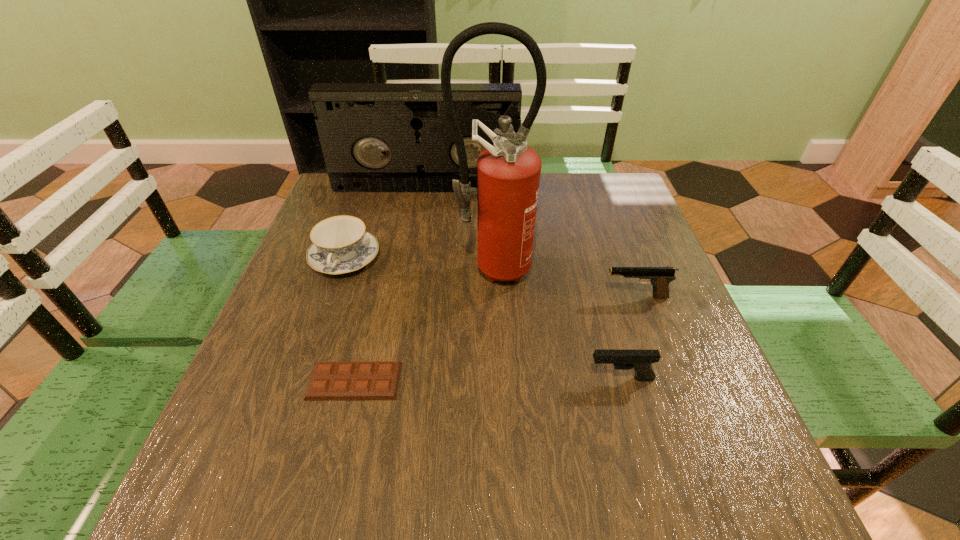
I want to click on free space located at the muzzle of the third nearest object, so click(443, 297).

Where is `free region located at the muzzle of the third nearest object`? The image size is (960, 540). free region located at the muzzle of the third nearest object is located at coordinates (553, 297).

At what (x,y) coordinates should I click in order to perform the action: click on free region located 0.210m with the handle on the side of the chinaware. Please return your answer as a coordinate pair (x, y). Looking at the image, I should click on (310, 360).

Locate an element on the screen. free region located on the front-facing side of the nearer pistol is located at coordinates (450, 379).

Locate an element on the screen. This screenshot has width=960, height=540. vacant region located on the front-facing side of the nearer pistol is located at coordinates (434, 379).

Where is `vacant space located 0.130m on the front-facing side of the nearer pistol`? vacant space located 0.130m on the front-facing side of the nearer pistol is located at coordinates (516, 379).

The width and height of the screenshot is (960, 540). Find the location of `free location located 0.260m on the right of the chocolate bar`. free location located 0.260m on the right of the chocolate bar is located at coordinates (541, 381).

Find the location of a particular element. The width and height of the screenshot is (960, 540). object that is at the far edge is located at coordinates (376, 137).

You are a GUI agent. You are given a task and a screenshot of the screen. Output one action in this format:
    pyautogui.click(x=<x>, y=<y>)
    Task: Click on the videotape that is at the left edge
    The image size is (960, 540).
    Given the screenshot: What is the action you would take?
    pyautogui.click(x=376, y=137)

The image size is (960, 540). In order to click on chinaware that is at the left edge in this screenshot , I will do `click(341, 245)`.